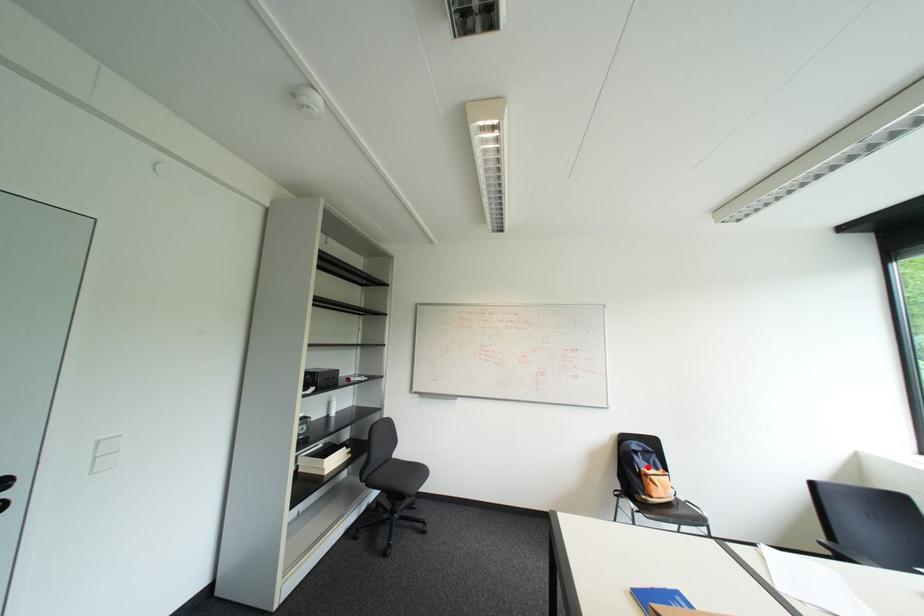
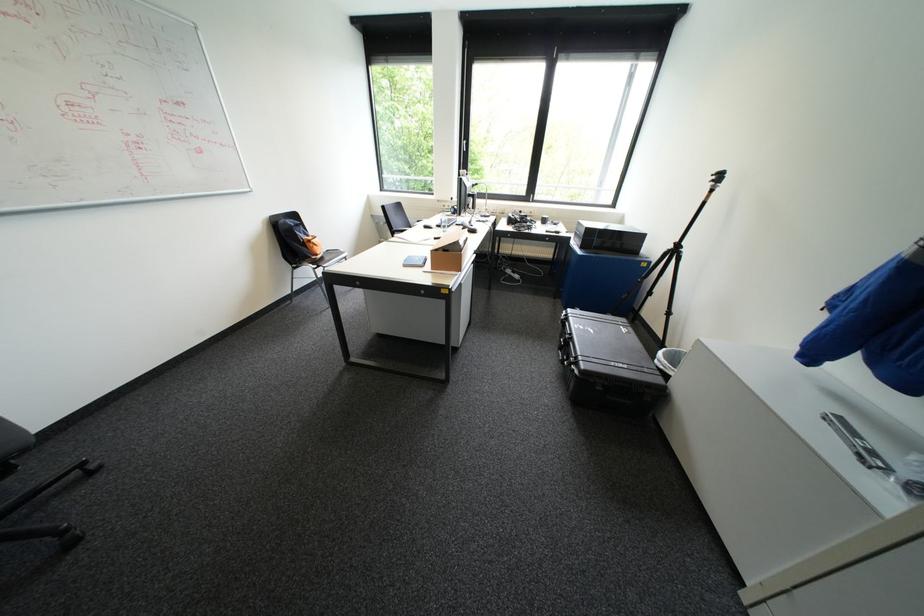
Question: I am providing you with two images of the same scene from different viewpoints. A red point is shown in image1. For the corresponding object point in image2, is it positioned nearer or farther from the camera?

Choices:
 (A) Nearer
 (B) Farther

Answer: (A)